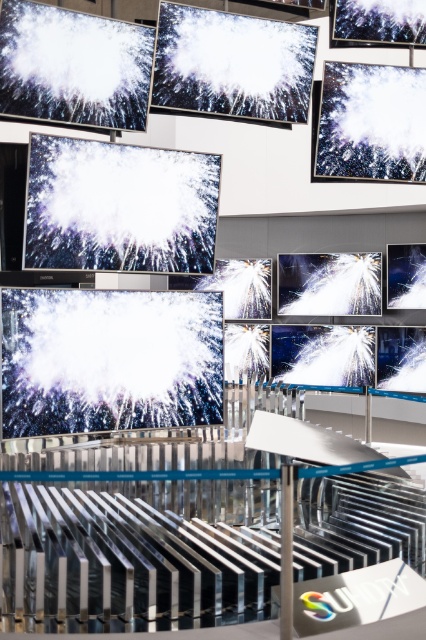
Question: Where is white glossy monitor at center located in relation to white glossy water at upper right in the image?

Choices:
 (A) below
 (B) above

Answer: (A)

Question: Among these objects, which one is nearest to the camera?

Choices:
 (A) white glossy water at upper right
 (B) white glossy monitor at upper left

Answer: (B)

Question: Can you confirm if white glossy water at upper right is wider than matte black monitor at center?

Choices:
 (A) no
 (B) yes

Answer: (B)

Question: Which point is farther to the camera?

Choices:
 (A) (97, 179)
 (B) (393, 253)
 (C) (60, 77)
 (D) (339, 150)

Answer: (B)

Question: Which point is farther to the camera?

Choices:
 (A) matte black monitor at center
 (B) white glossy screen at center
 (C) white glossy monitor at upper left
 (D) white glossy monitor at center

Answer: (A)

Question: Is white glossy monitor at upper left below white glossy water at upper right?

Choices:
 (A) no
 (B) yes

Answer: (A)